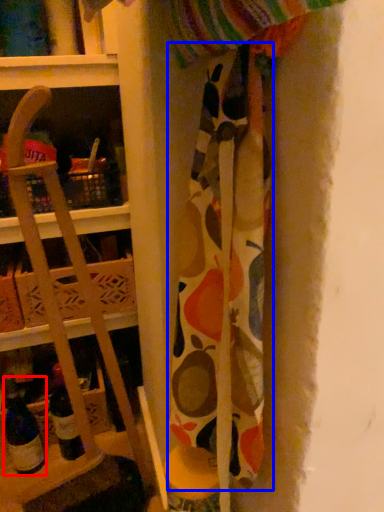
Question: Which of the following is the closest to the observer, wine bottle (highlighted by a red box) or fabric (highlighted by a blue box)?

Choices:
 (A) wine bottle
 (B) fabric

Answer: (B)